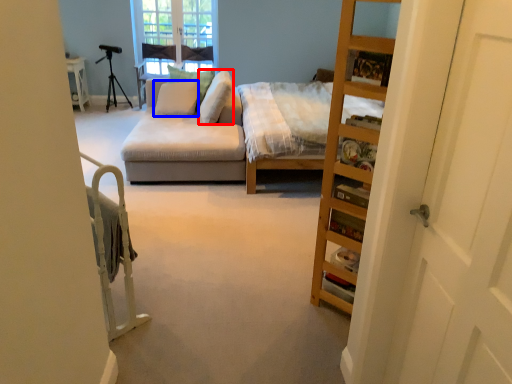
Question: Among these objects, which one is nearest to the camera, pillow (highlighted by a red box) or pillow (highlighted by a blue box)?

Choices:
 (A) pillow
 (B) pillow

Answer: (A)